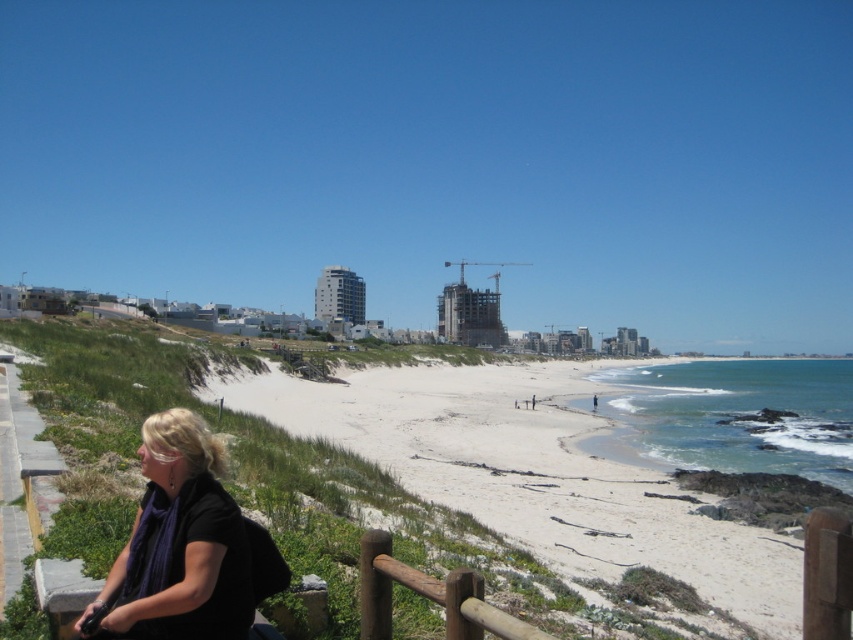
Question: Does black matte scarf at lower left have a greater width compared to brown wooden rail at lower center?

Choices:
 (A) no
 (B) yes

Answer: (A)

Question: Among these objects, which one is nearest to the camera?

Choices:
 (A) black matte scarf at lower left
 (B) brown wooden rail at lower center

Answer: (B)

Question: Observing the image, what is the correct spatial positioning of black matte scarf at lower left in reference to brown wooden rail at lower center?

Choices:
 (A) below
 (B) above

Answer: (B)

Question: Can you confirm if black matte scarf at lower left is positioned to the left of brown wooden rail at lower center?

Choices:
 (A) no
 (B) yes

Answer: (B)

Question: Which of the following is the farthest from the observer?

Choices:
 (A) (376, 545)
 (B) (154, 554)

Answer: (A)